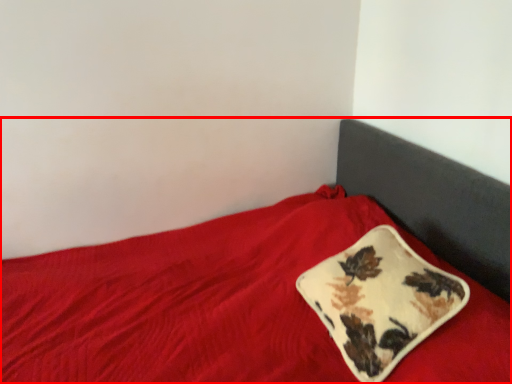
Question: From the image's perspective, where is bed (annotated by the red box) located in relation to pillow in the image?

Choices:
 (A) above
 (B) below

Answer: (B)